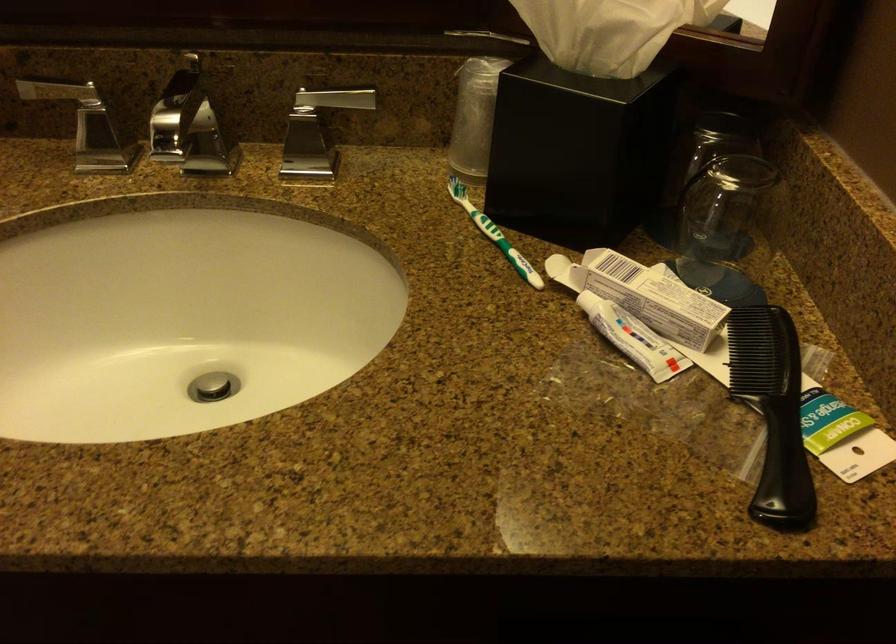
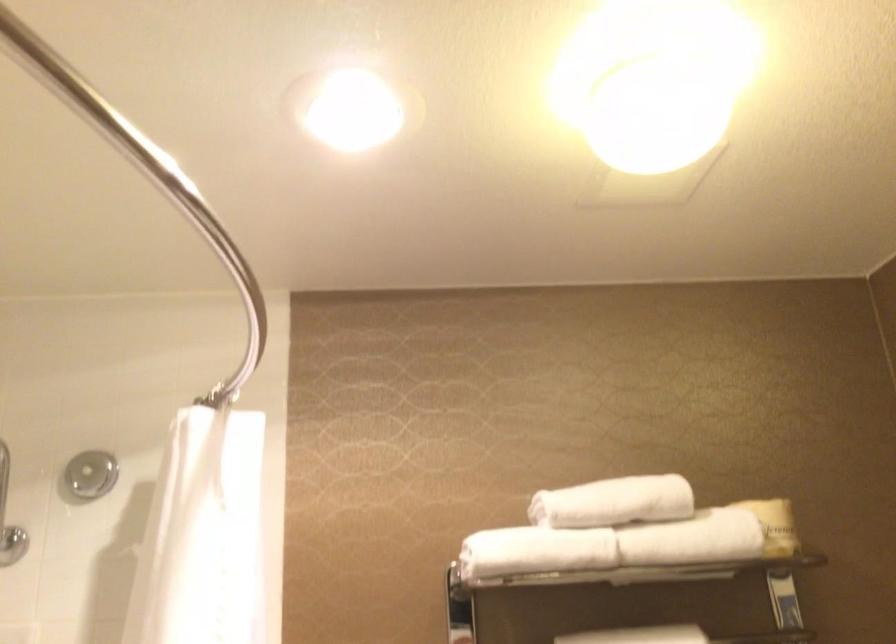
How did the camera likely rotate?

The camera's rotation is toward left-up.